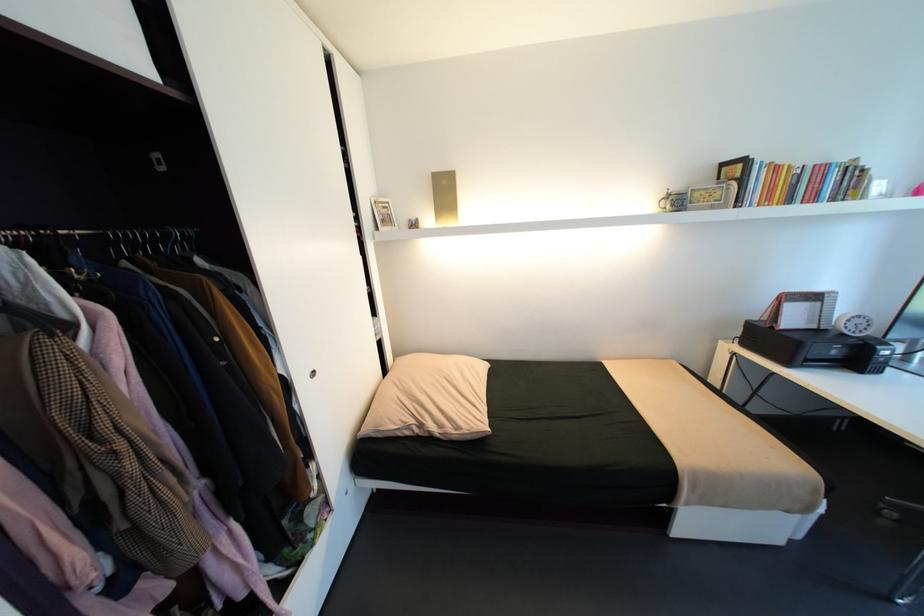
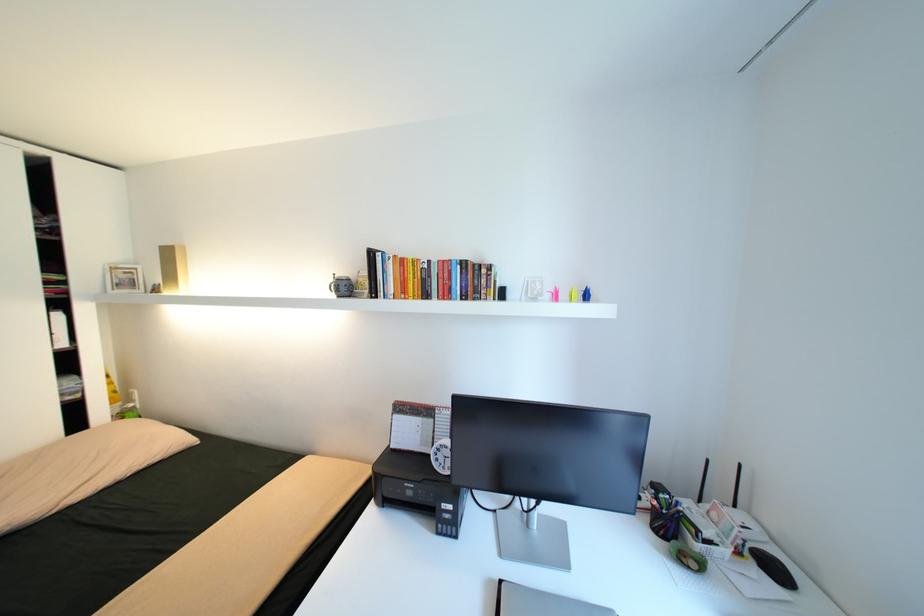
The point at [419,217] is marked in the first image. Where is the corresponding point in the second image?

(164, 284)